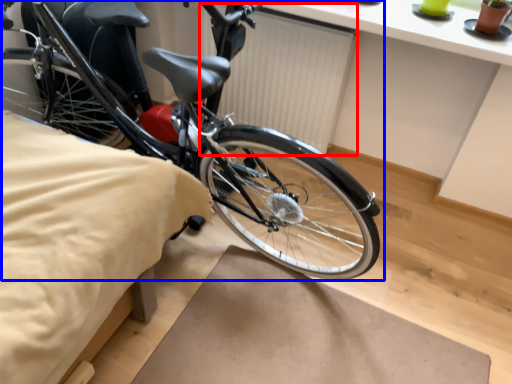
Question: Among these objects, which one is farthest to the camera, radiator (highlighted by a red box) or bicycle (highlighted by a blue box)?

Choices:
 (A) radiator
 (B) bicycle

Answer: (A)